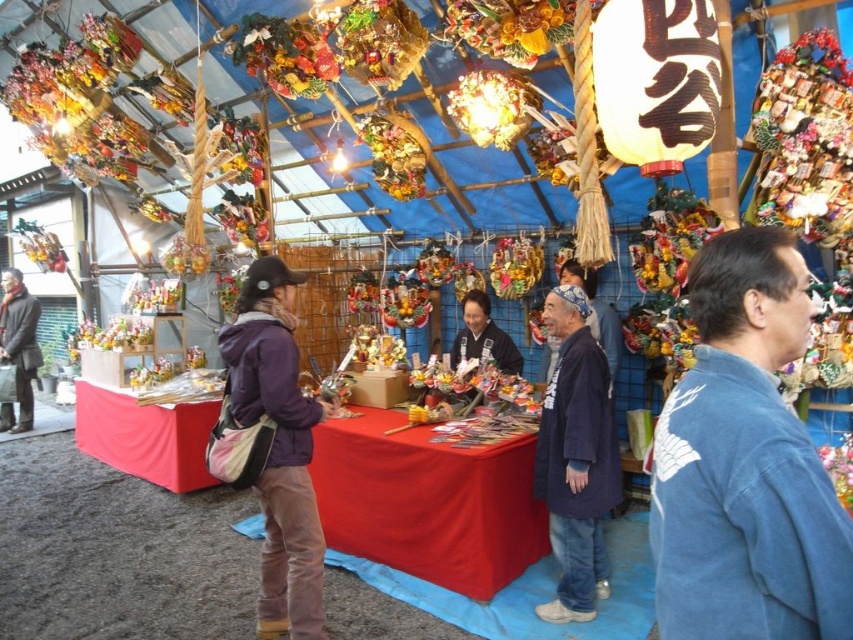
Is point (276, 618) less distant than point (35, 372)?

Yes, it is.

Is purple fleece jacket at center behind dark gray wool coat at left?

No.

Find the location of a particular element. The width and height of the screenshot is (853, 640). purple fleece jacket at center is located at coordinates (271, 449).

How much distance is there between dark gray wool coat at left and dark blue fabric at center?

dark gray wool coat at left and dark blue fabric at center are 17.68 feet apart.

Does point (21, 304) come farther from viewer compared to point (490, 330)?

Yes, point (21, 304) is farther from viewer.

Is point (33, 340) positioned behind point (473, 342)?

Yes, it is.

I want to click on dark gray wool coat at left, so click(x=18, y=348).

Which is in front, point (793, 554) or point (248, 310)?

Positioned in front is point (793, 554).

Is blue denim jacket at lower right smaller than purple fleece jacket at center?

Yes, blue denim jacket at lower right is smaller than purple fleece jacket at center.

At what (x,y) coordinates should I click in order to perform the action: click on blue denim jacket at lower right. Please return your answer as a coordinate pair (x, y). The height and width of the screenshot is (640, 853). Looking at the image, I should click on (746, 464).